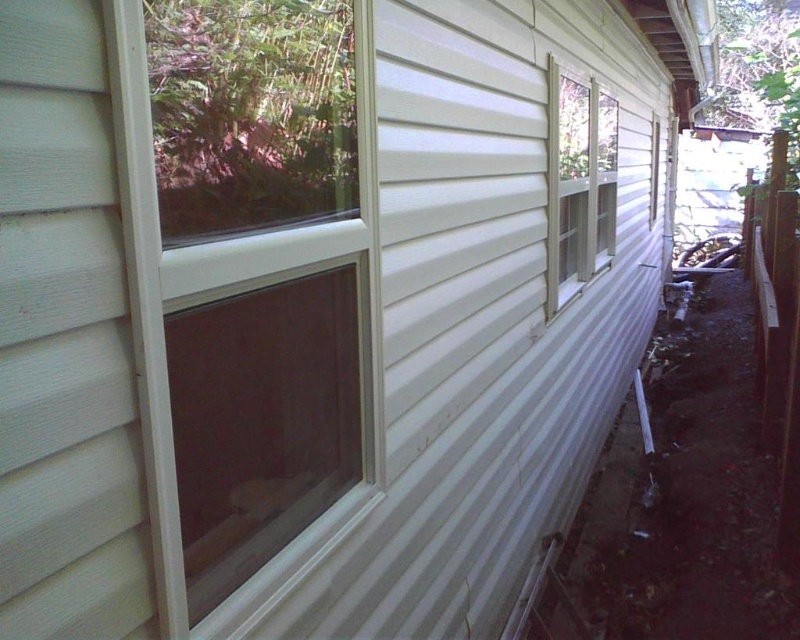
Question: Which object appears farthest from the camera in this image?

Choices:
 (A) clear glass window at upper right
 (B) clear glass window at center

Answer: (A)

Question: Can you confirm if clear glass window at center is positioned above clear glass window at upper right?

Choices:
 (A) no
 (B) yes

Answer: (A)

Question: Can you confirm if clear glass window at center is bigger than clear glass window at upper right?

Choices:
 (A) no
 (B) yes

Answer: (A)

Question: Which of the following is the farthest from the observer?

Choices:
 (A) clear glass window at center
 (B) clear glass window at upper right

Answer: (B)

Question: In this image, where is clear glass window at center located relative to clear glass window at upper right?

Choices:
 (A) above
 (B) below

Answer: (B)